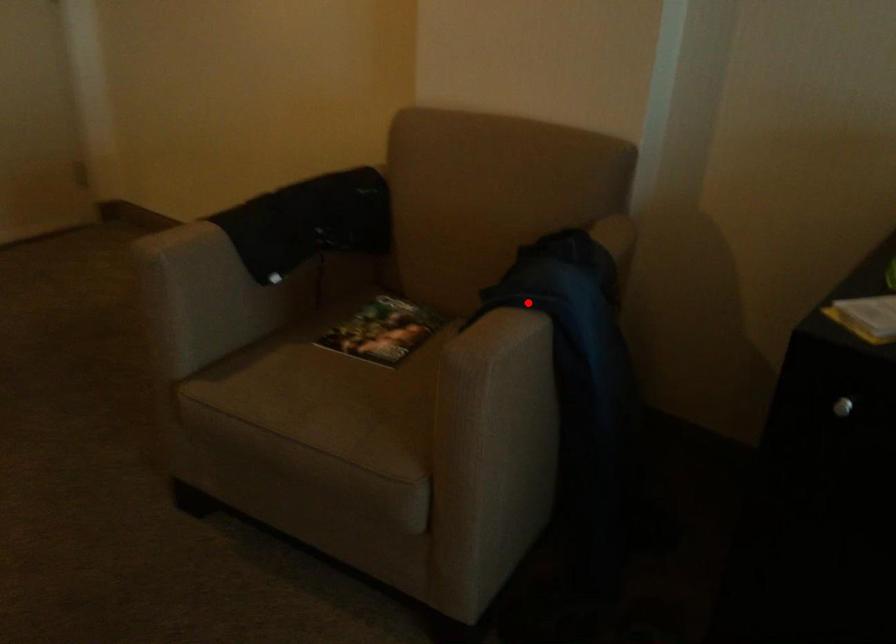
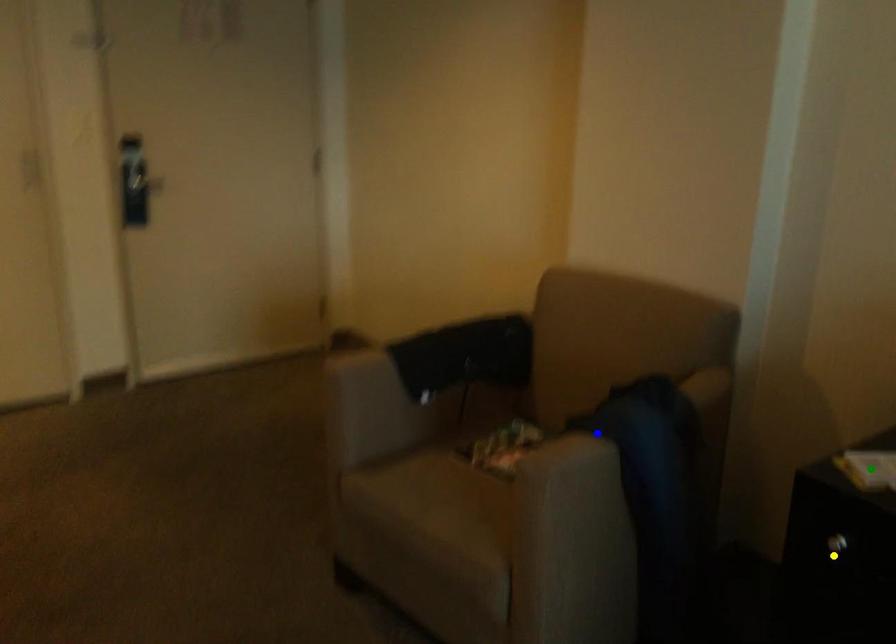
Question: I am providing you with two images of the same scene from different viewpoints. A red point is marked on the first image. You are given multiple points on the second image. Which point in image 2 is actually the same real-world point as the red point in image 1?

Choices:
 (A) blue point
 (B) green point
 (C) yellow point

Answer: (A)